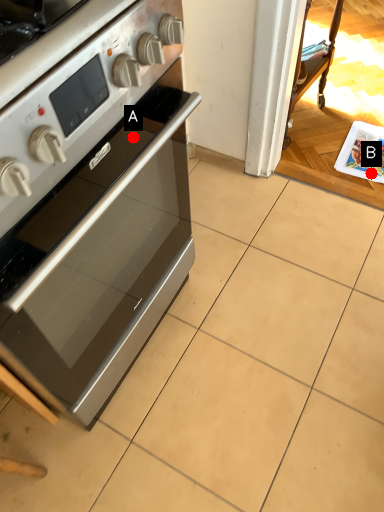
Question: Two points are circled on the image, labeled by A and B beside each circle. Among these points, which one is nearest to the camera?

Choices:
 (A) A is closer
 (B) B is closer

Answer: (A)